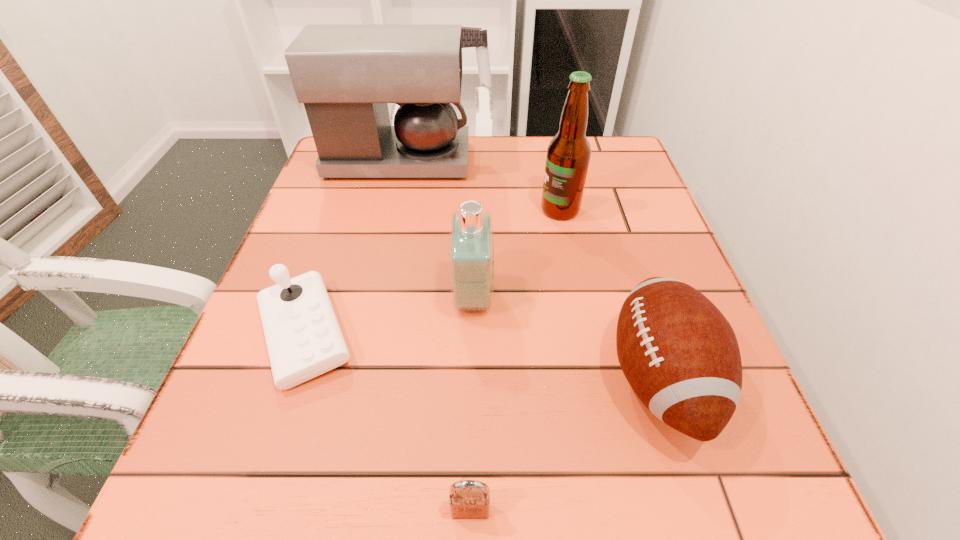
Locate an element on the screen. free spot located 0.170m on the front label of the third tallest object is located at coordinates (588, 297).

The image size is (960, 540). Find the location of `free spot located 0.230m on the laces of the football`. free spot located 0.230m on the laces of the football is located at coordinates (458, 379).

The width and height of the screenshot is (960, 540). I want to click on blank area located 0.320m on the laces of the football, so click(x=398, y=379).

The image size is (960, 540). What are the coordinates of `vacant area situated on the laces of the football` in the screenshot? It's located at (510, 379).

Identify the location of free region located 0.280m on the back of the joystick. Image resolution: width=960 pixels, height=540 pixels. (352, 195).

At what (x,y) coordinates should I click in order to perform the action: click on object that is at the far edge. Please return your answer as a coordinate pair (x, y). The width and height of the screenshot is (960, 540). Looking at the image, I should click on (345, 75).

The image size is (960, 540). Find the location of `football positioned at the near edge`. football positioned at the near edge is located at coordinates (680, 355).

This screenshot has width=960, height=540. I want to click on padlock located at the near edge, so click(x=469, y=499).

The height and width of the screenshot is (540, 960). I want to click on coffee maker that is at the left edge, so pyautogui.click(x=345, y=75).

You are a GUI agent. You are given a task and a screenshot of the screen. Output one action in this format:
    pyautogui.click(x=<x>, y=<y>)
    Task: Click on the joystick that is at the left edge
    The height and width of the screenshot is (540, 960).
    Given the screenshot: What is the action you would take?
    pyautogui.click(x=304, y=340)